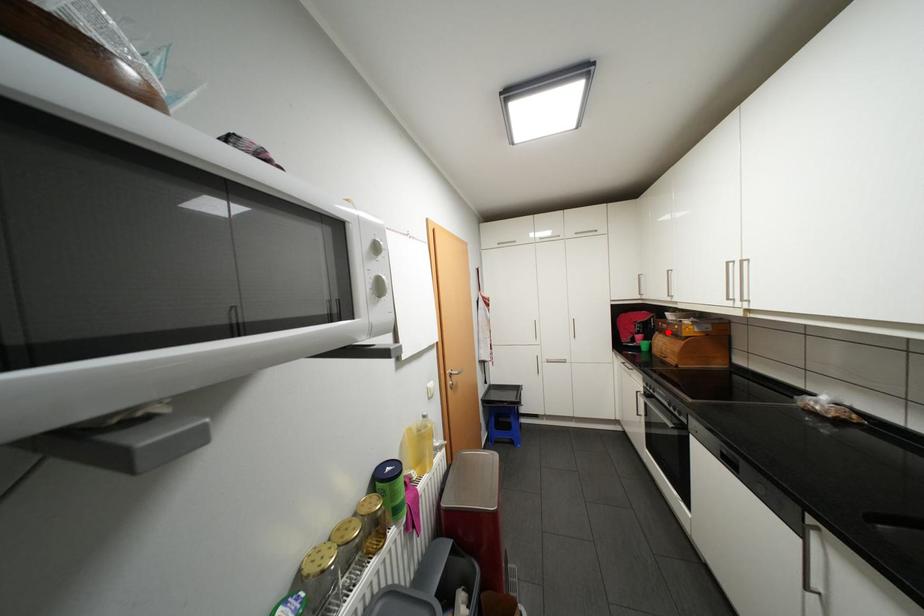
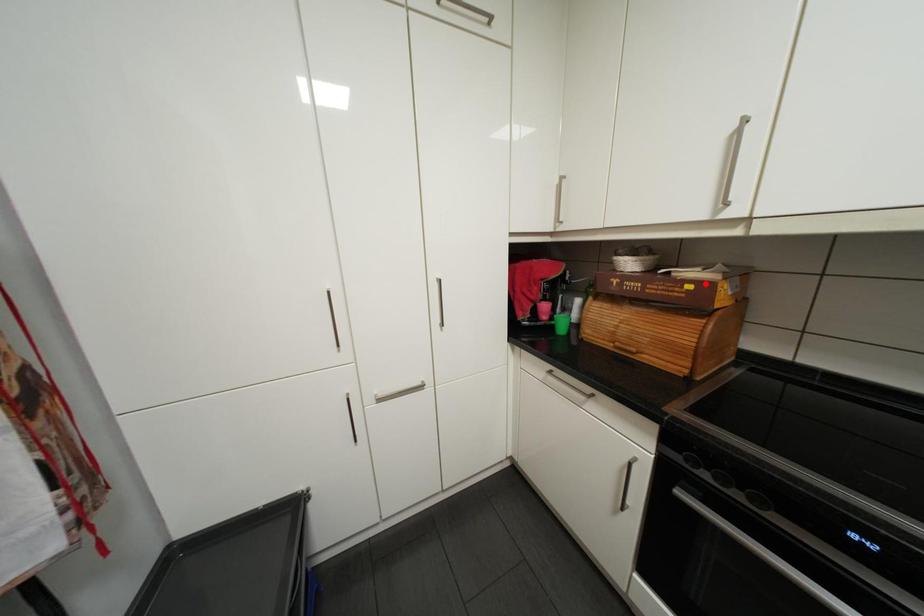
I am providing you with two images of the same scene from different viewpoints. A red point is marked on the first image and another point is marked on the second image. Are the points marked in image1 and image2 representing the same 3D position?

No